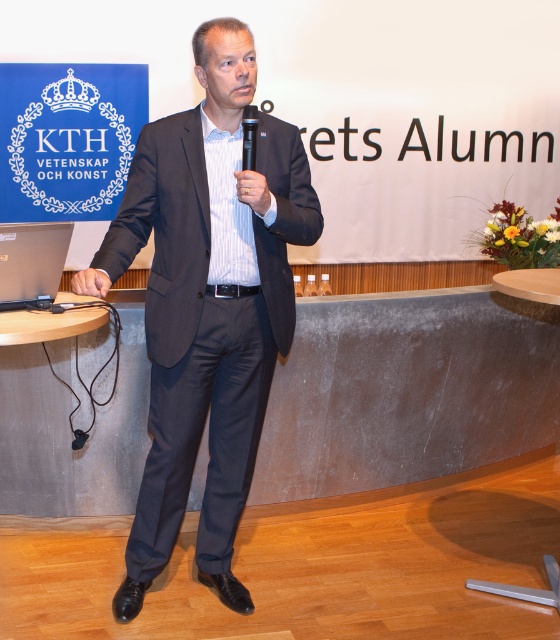
Question: Is dark gray suit at center wider than silver metallic laptop at lower left?

Choices:
 (A) no
 (B) yes

Answer: (B)

Question: From the image, what is the correct spatial relationship of dark gray suit at center in relation to black plastic microphone at center?

Choices:
 (A) left
 (B) right

Answer: (A)

Question: Which point appears farthest from the camera in this image?

Choices:
 (A) (218, 308)
 (B) (14, 285)
 (C) (254, 115)

Answer: (A)

Question: Which point is farther to the camera?

Choices:
 (A) (0, 275)
 (B) (304, 150)
 (C) (245, 122)

Answer: (B)

Question: Estimate the real-world distances between objects in this image. Which object is farther from the dark gray suit at center?

Choices:
 (A) black plastic microphone at center
 (B) silver metallic laptop at lower left

Answer: (A)

Question: Is dark gray suit at center thinner than silver metallic laptop at lower left?

Choices:
 (A) yes
 (B) no

Answer: (B)